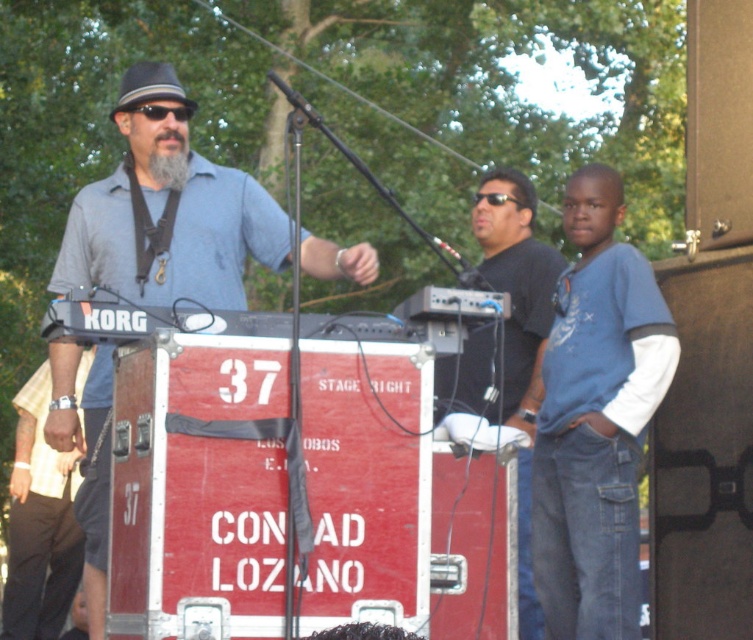
Question: Can you confirm if matte black shirt at center is positioned above graywool-likebeard at center?

Choices:
 (A) yes
 (B) no

Answer: (B)

Question: Which of the following is the farthest from the observer?

Choices:
 (A) (127, 102)
 (B) (611, 372)

Answer: (A)

Question: Which object is the closest to the blue cotton shirt at right?

Choices:
 (A) blue denim shirt at center
 (B) matte black shirt at center

Answer: (B)

Question: Which object is the farthest from the gray felt fedora at upper left?

Choices:
 (A) brown leather wristwatch at left
 (B) blue cotton shirt at right
 (C) graywool-likebeard at center

Answer: (A)

Question: Does matte black shirt at center appear over graywool-likebeard at center?

Choices:
 (A) no
 (B) yes

Answer: (A)

Question: Does matte black shirt at center appear over graywool-likebeard at center?

Choices:
 (A) yes
 (B) no

Answer: (B)